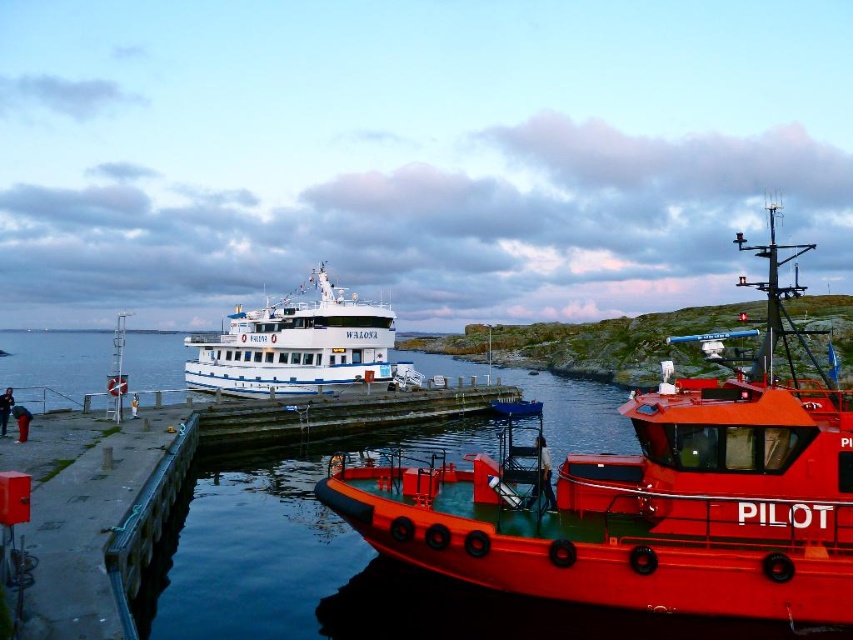
You are standing on the dock and see the point marked at coordinates (647, 497). What object is located at that point?

The point at coordinates (647, 497) marks the location of the rubberized red pilot boat at right.

You are a photographer planning to take a photo of the harbor scene. You want to ensure both the rubberized red pilot boat at right and the white matte ferry at center are clearly visible. Based on their positions, which boat should you focus on first to ensure both are in sharp focus?

You should focus on the white matte ferry at center first because the rubberized red pilot boat at right is closer to the viewer. By focusing on the farther object, the closer one may still be within the depth of field, ensuring both are sharp.

Looking at this image, you are standing at the edge of the harbor looking at the image. There are two points marked on the image, point 1 at coordinates point (776, 333) and point 2 at coordinates point (270, 378). Which point is closer to you?

Point (776, 333) is closer to the viewer than point (270, 378).